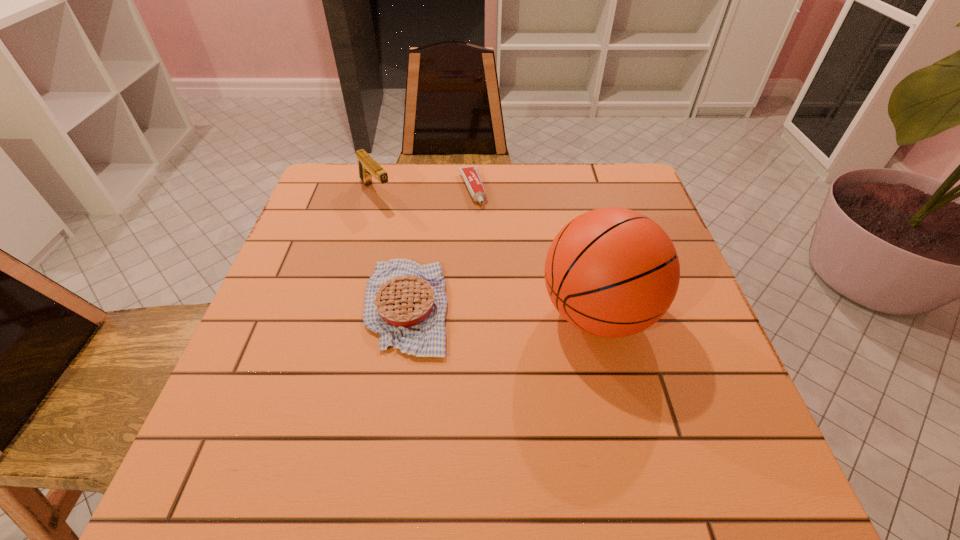
At what (x,y) coordinates should I click in order to perform the action: click on vacant space that's between the pistol and the shortest object. Please return your answer as a coordinate pair (x, y). The width and height of the screenshot is (960, 540). Looking at the image, I should click on (423, 191).

Identify the location of free space between the second object from right to left and the pistol. The height and width of the screenshot is (540, 960). (423, 191).

This screenshot has width=960, height=540. In order to click on empty space that is in between the tallest object and the third tallest object in this screenshot , I will do `click(502, 310)`.

Identify the location of vacant area that lies between the toothpaste and the second shortest object. 439,247.

Point out which object is positioned as the second nearest to the rightmost object. Please provide its 2D coordinates. Your answer should be formatted as a tuple, i.e. [(x, y)], where the tuple contains the x and y coordinates of a point satisfying the conditions above.

[(470, 174)]

Select which object appears as the second closest to the pistol. Please provide its 2D coordinates. Your answer should be formatted as a tuple, i.e. [(x, y)], where the tuple contains the x and y coordinates of a point satisfying the conditions above.

[(405, 302)]